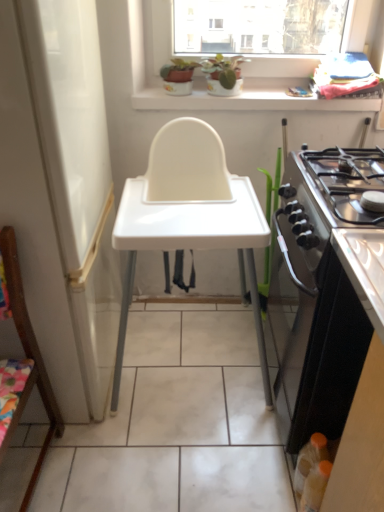
The width and height of the screenshot is (384, 512). What are the coordinates of `vacant space underneath white plastic changing table at center (from a real-world perspective)` in the screenshot? It's located at (188, 347).